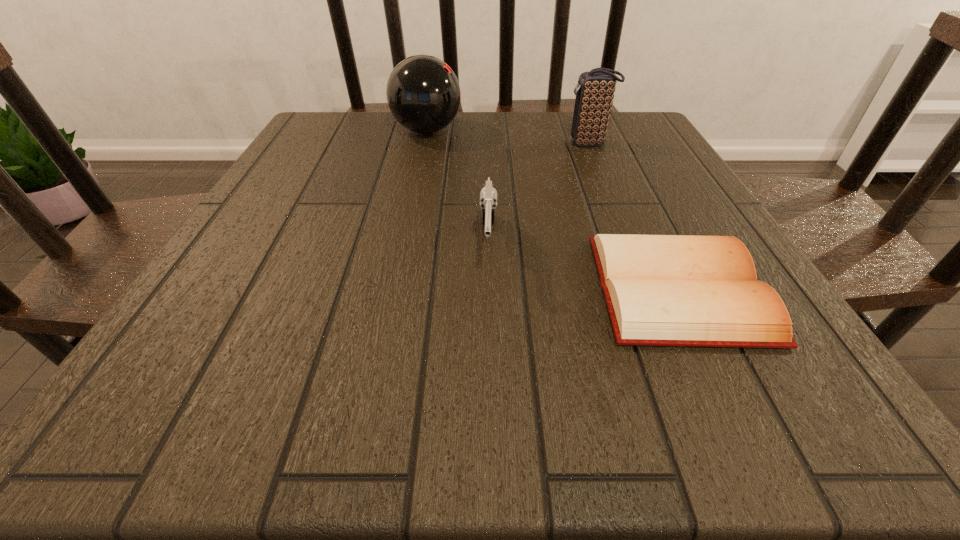
Identify the location of the leftmost object. (423, 93).

The width and height of the screenshot is (960, 540). In order to click on clutch bag in this screenshot , I will do `click(594, 91)`.

Where is `gun`? This screenshot has width=960, height=540. gun is located at coordinates (488, 196).

Image resolution: width=960 pixels, height=540 pixels. In order to click on the second object from left to right in this screenshot , I will do `click(488, 196)`.

Where is `Bible`? Bible is located at coordinates (661, 290).

Identify the location of free location located on the surface of the bowling ball near the finger holes. The image size is (960, 540). (618, 131).

Where is `free space located with the zip open on the clutch bag`? This screenshot has height=540, width=960. free space located with the zip open on the clutch bag is located at coordinates (512, 143).

The height and width of the screenshot is (540, 960). In order to click on vacant space located 0.370m with the zip open on the clutch bag in this screenshot , I will do `click(411, 143)`.

At what (x,y) coordinates should I click in order to perform the action: click on free region located 0.230m with the zip open on the clutch bag. Please return your answer as a coordinate pair (x, y). The width and height of the screenshot is (960, 540). Looking at the image, I should click on (469, 143).

You are a GUI agent. You are given a task and a screenshot of the screen. Output one action in this format:
    pyautogui.click(x=<x>, y=<y>)
    Task: Click on the free space located 0.190m at the muzzle of the gun
    This screenshot has width=960, height=540.
    Given the screenshot: What is the action you would take?
    pyautogui.click(x=492, y=392)